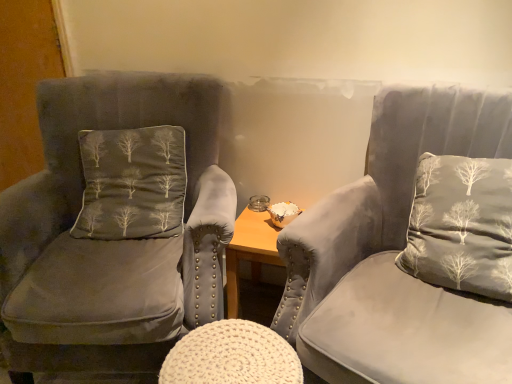
Question: Is velvet gray chair at right, arranged as the first chair when viewed from the right, inside the boundaries of gray fabric pillow at right, which is counted as the second pillow, starting from the left, or outside?

Choices:
 (A) outside
 (B) inside

Answer: (A)

Question: Is point (442, 301) positioned closer to the camera than point (468, 244)?

Choices:
 (A) closer
 (B) farther

Answer: (B)

Question: Which object is positioned farthest from the gray fabric pillow at right, arranged as the 1th pillow when viewed from the right?

Choices:
 (A) dark gray velvet pillow with tree pattern at left, which ranks as the 2th pillow in right-to-left order
 (B) white knitted stool at center
 (C) suede gray chair at left, which is the first chair in left-to-right order
 (D) velvet gray chair at right, the 2th chair from the left

Answer: (A)

Question: Which object is positioned farthest from the gray fabric pillow at right, arranged as the 1th pillow when viewed from the right?

Choices:
 (A) suede gray chair at left, which is the first chair in left-to-right order
 (B) velvet gray chair at right, the 2th chair from the left
 (C) white knitted stool at center
 (D) dark gray velvet pillow with tree pattern at left, positioned as the 1th pillow in left-to-right order

Answer: (D)